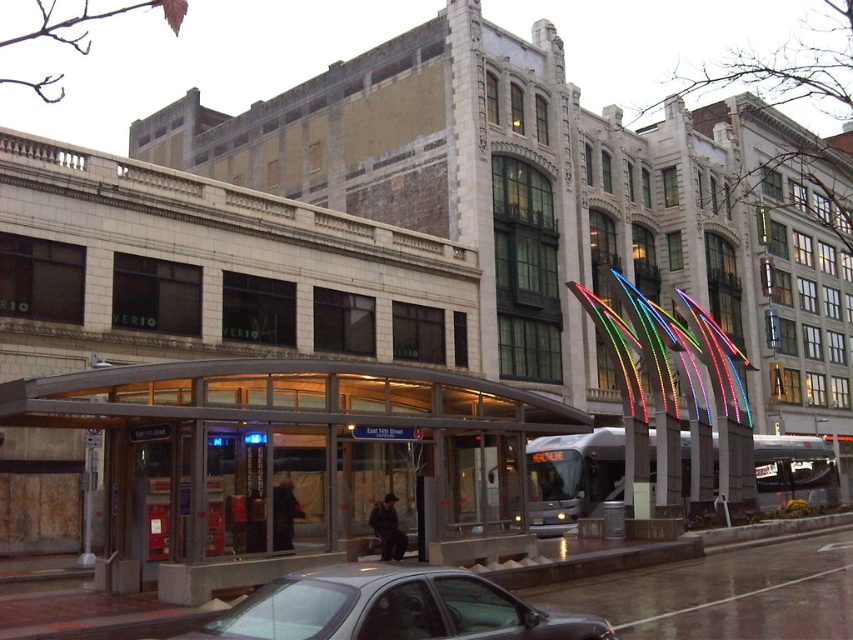
Is point (223, 541) positioned behind point (704, 349)?

No.

Which is more to the right, translucent glass bus stop at center or neon lights at center?

neon lights at center is more to the right.

Which is behind, point (422, 385) or point (619, 282)?

The point (619, 282) is behind.

Locate an element on the screen. Image resolution: width=853 pixels, height=640 pixels. translucent glass bus stop at center is located at coordinates (291, 461).

Can you confirm if neon lights at center is wider than metallic gray sedan at lower center?

Correct, the width of neon lights at center exceeds that of metallic gray sedan at lower center.

Describe the element at coordinates (674, 400) in the screenshot. I see `neon lights at center` at that location.

The image size is (853, 640). What are the coordinates of `neon lights at center` in the screenshot? It's located at (674, 400).

I want to click on neon lights at center, so click(x=674, y=400).

Which is below, translucent glass bus stop at center or metallic gray sedan at lower center?

Positioned lower is metallic gray sedan at lower center.

Can you confirm if translucent glass bus stop at center is smaller than metallic gray sedan at lower center?

Incorrect, translucent glass bus stop at center is not smaller in size than metallic gray sedan at lower center.

Locate an element on the screen. The width and height of the screenshot is (853, 640). translucent glass bus stop at center is located at coordinates (291, 461).

Where is `translucent glass bus stop at center`? translucent glass bus stop at center is located at coordinates (291, 461).